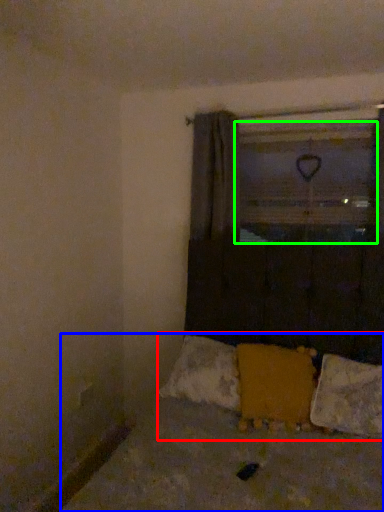
Question: Based on their relative distances, which object is nearer to bedding (highlighted by a red box)? Choose from bed (highlighted by a blue box) and window screen (highlighted by a green box).

Choices:
 (A) bed
 (B) window screen

Answer: (A)